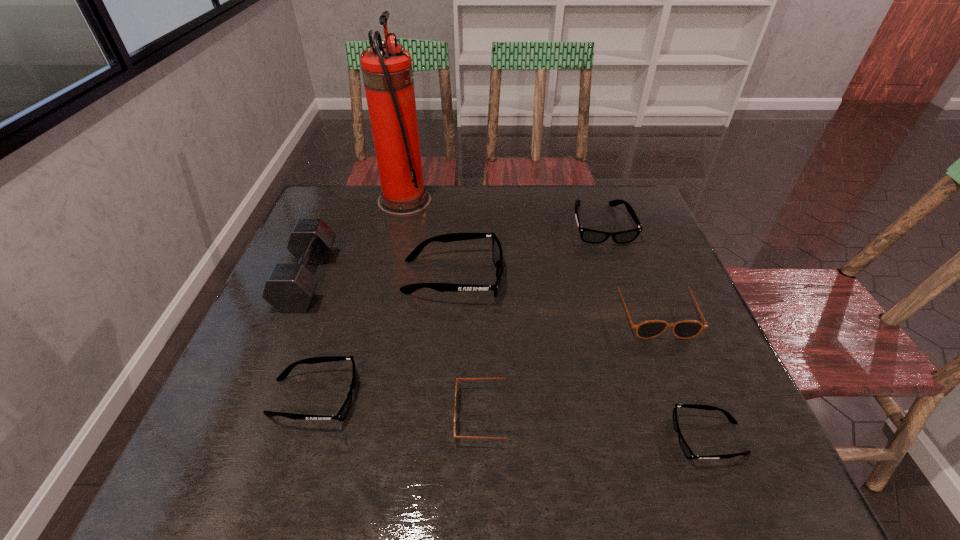
Locate an element on the screen. Image resolution: width=960 pixels, height=540 pixels. the tallest object is located at coordinates (387, 72).

Identify the location of dumbbell. The image size is (960, 540). (289, 288).

Locate an element on the screen. The image size is (960, 540). the third black sunglasses from right to left is located at coordinates (497, 253).

The image size is (960, 540). I want to click on the third nearest black sunglasses, so click(x=497, y=253).

You are a GUI agent. You are given a task and a screenshot of the screen. Output one action in this format:
    pyautogui.click(x=<x>, y=<y>)
    Task: Click on the right brown sunglasses
    
    Given the screenshot: What is the action you would take?
    pyautogui.click(x=685, y=329)

Where is `the bigger brown sunglasses`? The height and width of the screenshot is (540, 960). the bigger brown sunglasses is located at coordinates (685, 329).

Where is `the farthest black sunglasses`? the farthest black sunglasses is located at coordinates (587, 235).

At what (x,y) coordinates should I click in order to perform the action: click on the farthest sunglasses. Please return your answer as a coordinate pair (x, y). Looking at the image, I should click on (587, 235).

Locate an element on the screen. the smaller brown sunglasses is located at coordinates (457, 379).

Image resolution: width=960 pixels, height=540 pixels. What are the coordinates of `the left brown sunglasses` in the screenshot? It's located at (457, 379).